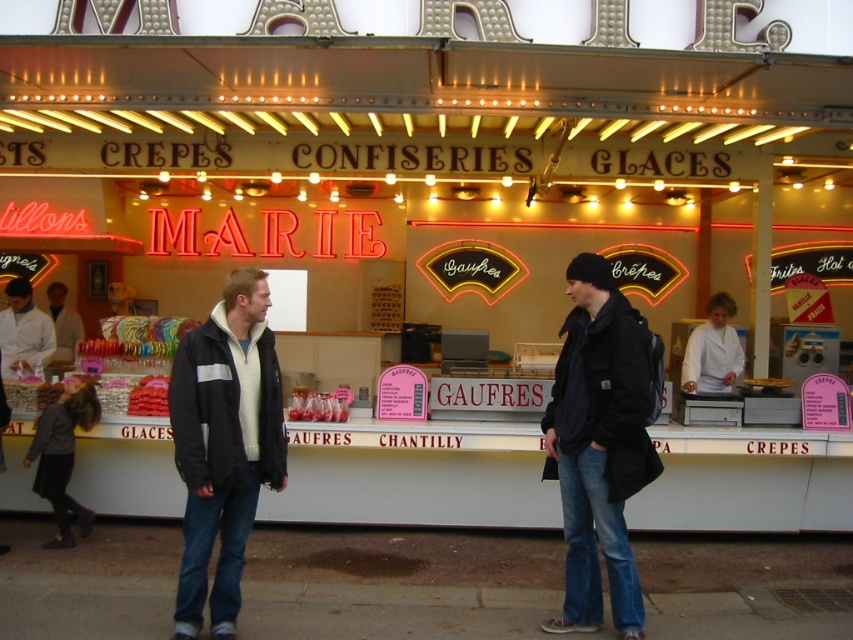
Question: Considering the real-world distances, which object is farthest from the translucent plastic bottles at center?

Choices:
 (A) matte plastic gaufre at center
 (B) white cotton jacket at center

Answer: (A)

Question: Does white cotton jacket at center appear over shiny red candy at center?

Choices:
 (A) yes
 (B) no

Answer: (A)

Question: Estimate the real-world distances between objects in this image. Which object is farther from the white lab coat at left?

Choices:
 (A) matte plastic gaufre at center
 (B) shiny red candy at center
 (C) black leather jacket at center
 (D) dark blue jacket at center

Answer: (A)

Question: Is translucent plastic bottles at center smaller than shiny red candy at center?

Choices:
 (A) yes
 (B) no

Answer: (B)

Question: Which point is closer to the camera taking this photo?

Choices:
 (A) (322, 412)
 (B) (149, 403)

Answer: (B)

Question: Does shiny red candy at center appear on the right side of matte plastic gaufre at center?

Choices:
 (A) yes
 (B) no

Answer: (B)